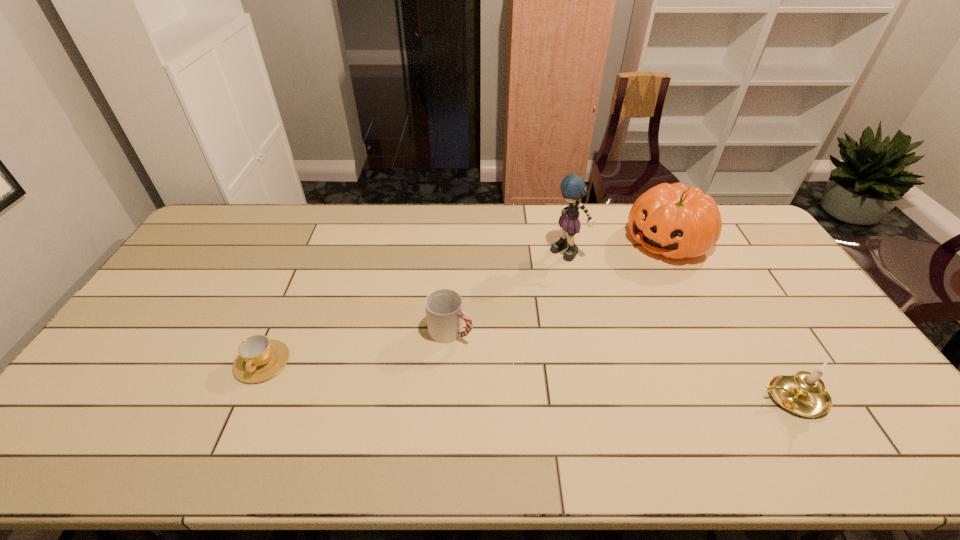
This screenshot has height=540, width=960. Find the location of `free space located 0.310m on the handle side of the third tallest object`. free space located 0.310m on the handle side of the third tallest object is located at coordinates (636, 397).

This screenshot has height=540, width=960. Find the location of `vacant region located on the handle side of the third tallest object`. vacant region located on the handle side of the third tallest object is located at coordinates (708, 397).

Locate an element on the screen. vacant point located on the front-facing side of the third object from right to left is located at coordinates (500, 329).

Where is `free space located on the front-facing side of the third object from right to left`? This screenshot has height=540, width=960. free space located on the front-facing side of the third object from right to left is located at coordinates (531, 295).

This screenshot has width=960, height=540. In order to click on vacant area located 0.120m on the front-facing side of the third object from right to left in this screenshot , I will do `click(541, 283)`.

Where is `free space located 0.270m on the carved face of the second tallest object`? The image size is (960, 540). free space located 0.270m on the carved face of the second tallest object is located at coordinates (596, 298).

Find the location of a particular element. The width and height of the screenshot is (960, 540). vacant space situated on the carved face of the second tallest object is located at coordinates (604, 292).

Identify the location of vacant region located 0.340m on the carved face of the second tallest object. The height and width of the screenshot is (540, 960). (582, 309).

At what (x,y) coordinates should I click in order to perform the action: click on vacant space located on the side of the right cup where the handle is located. Please return your answer as a coordinate pair (x, y). The width and height of the screenshot is (960, 540). Looking at the image, I should click on (574, 399).

You are a GUI agent. You are given a task and a screenshot of the screen. Output one action in this format:
    pyautogui.click(x=<x>, y=<y>)
    Task: Click on the free spot located on the side of the right cup where the handle is located
    Image resolution: width=960 pixels, height=540 pixels.
    Given the screenshot: What is the action you would take?
    pyautogui.click(x=504, y=360)